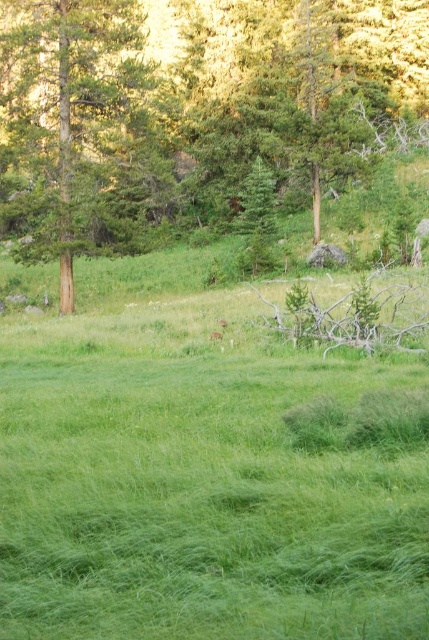
You are standing at the brown wood tree at center and want to reach a hidden pond located 32.09 meters away. If you walk straight ahead, will you reach the pond before walking 30 meters?

The hidden pond is 32.09 meters away from the brown wood tree at center, so you will not reach it before walking 30 meters.

You are standing at the edge of the meadow in the image and see a point marked at coordinates (187, 113). What object is located at that point?

The point at coordinates (187, 113) marks the location of the brown wood tree at center.

You are standing in the meadow and want to walk from the point at coordinates (305, 189) to the point at coordinates (21, 100). Which direction should you head to reach your destination?

To move from point (305, 189) to point (21, 100), you should head diagonally downward and to the left. Since point (305, 189) is closer to the viewer than point (21, 100), moving in this direction will take you towards the background of the scene.